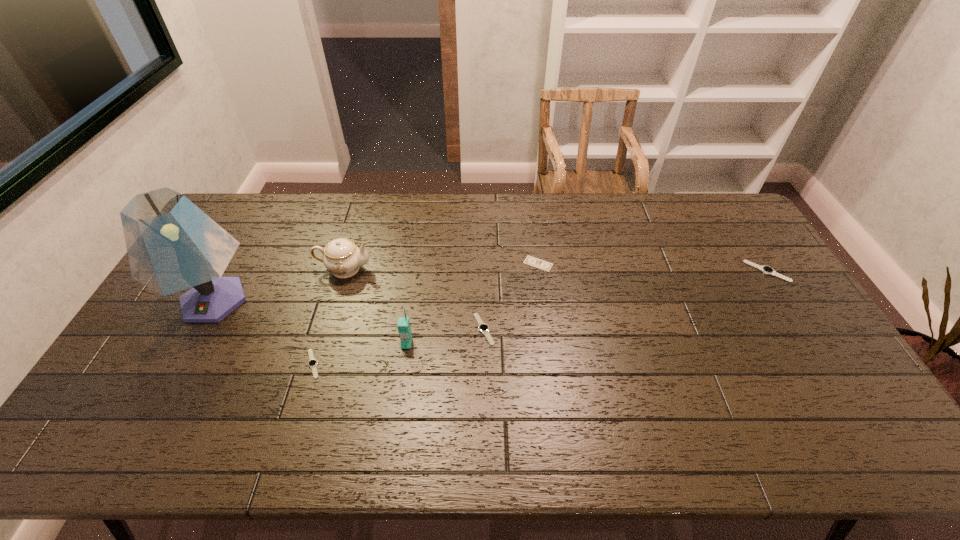
At what (x,y) coordinates should I click in order to perform the action: click on money. Please return your answer as a coordinate pair (x, y). Looking at the image, I should click on (532, 261).

Identify the location of the sixth object from left to right. Image resolution: width=960 pixels, height=540 pixels. (532, 261).

Locate an element on the screen. This screenshot has height=540, width=960. blank space located 0.350m on the right of the shortest watch is located at coordinates (452, 364).

Where is `vacant region located on the back of the second farthest watch`? The height and width of the screenshot is (540, 960). vacant region located on the back of the second farthest watch is located at coordinates (483, 264).

Locate an element on the screen. vacant area situated 0.140m on the back of the tallest watch is located at coordinates (742, 233).

You are a GUI agent. You are given a task and a screenshot of the screen. Output one action in this format:
    pyautogui.click(x=<x>, y=<y>)
    Task: Click on the vacant space located 0.140m on the base of the tallest object
    
    Given the screenshot: What is the action you would take?
    pyautogui.click(x=170, y=381)

The width and height of the screenshot is (960, 540). Find the location of `free space located at the spout of the chinaware`. free space located at the spout of the chinaware is located at coordinates (492, 269).

The height and width of the screenshot is (540, 960). I want to click on vacant space located 0.170m on the keypad of the cellular telephone, so click(x=397, y=406).

Where is `vacant space positioned on the front of the sixth object from left to right`? vacant space positioned on the front of the sixth object from left to right is located at coordinates (546, 323).

Locate an element on the screen. Image resolution: width=960 pixels, height=540 pixels. object at the left edge is located at coordinates (172, 245).